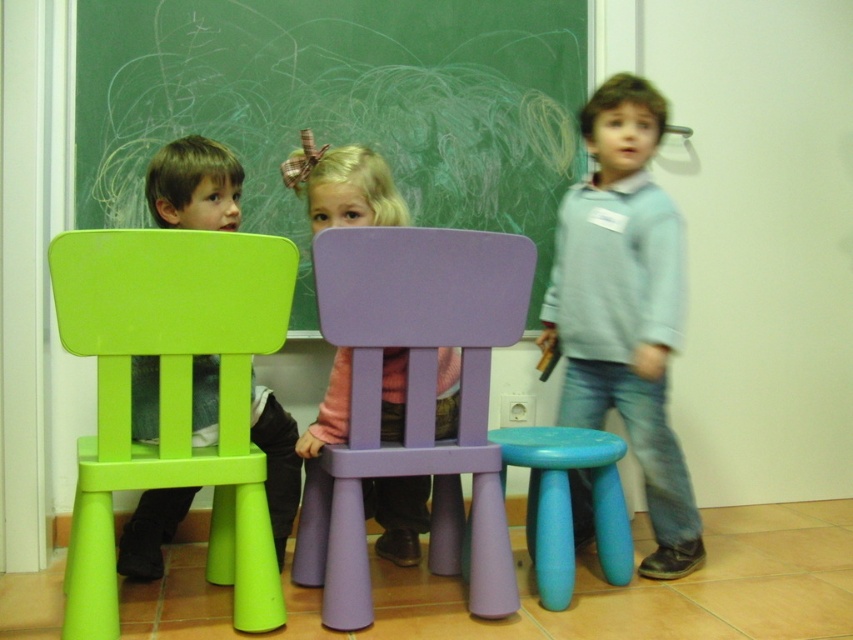
Can you confirm if green plastic chair at left is shorter than matte blue stool at lower center?

Incorrect, green plastic chair at left's height does not fall short of matte blue stool at lower center's.

Does point (274, 577) come closer to viewer compared to point (630, 544)?

Yes, it is in front of point (630, 544).

Describe the element at coordinates (170, 397) in the screenshot. I see `green plastic chair at left` at that location.

The image size is (853, 640). What are the coordinates of `green plastic chair at left` in the screenshot? It's located at (170, 397).

Is point (135, 186) farther from camera compared to point (376, 275)?

Yes, it is behind point (376, 275).

Which is more to the right, green chalkboard at upper center or purple plastic chair at center?

purple plastic chair at center is more to the right.

Measure the distance between point (546, 125) and camera.

Point (546, 125) and camera are 8.58 feet apart from each other.

Find the location of a particular element. This screenshot has width=853, height=640. green chalkboard at upper center is located at coordinates (338, 106).

Is purple plastic chair at center above pink fabric dress at center?

No.

Which is behind, point (306, 476) or point (373, 172)?

The point (306, 476) is more distant.

Locate an element on the screen. The image size is (853, 640). purple plastic chair at center is located at coordinates (x=413, y=403).